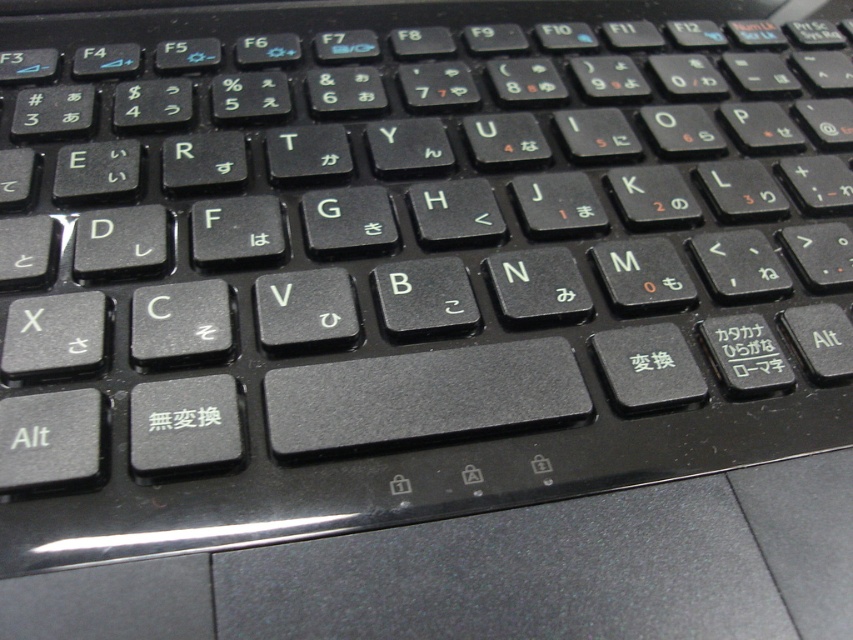
Question: Can you confirm if black matte keyboard at center is bigger than black matte text at center?

Choices:
 (A) yes
 (B) no

Answer: (A)

Question: Does black matte keyboard at center appear on the left side of black matte text at center?

Choices:
 (A) yes
 (B) no

Answer: (B)

Question: Which point appears closest to the camera in this image?

Choices:
 (A) (149, 417)
 (B) (656, 104)

Answer: (A)

Question: Which point is closer to the camera taking this photo?

Choices:
 (A) (215, 412)
 (B) (670, 412)

Answer: (A)

Question: Is black matte keyboard at center positioned before black matte text at center?

Choices:
 (A) yes
 (B) no

Answer: (A)